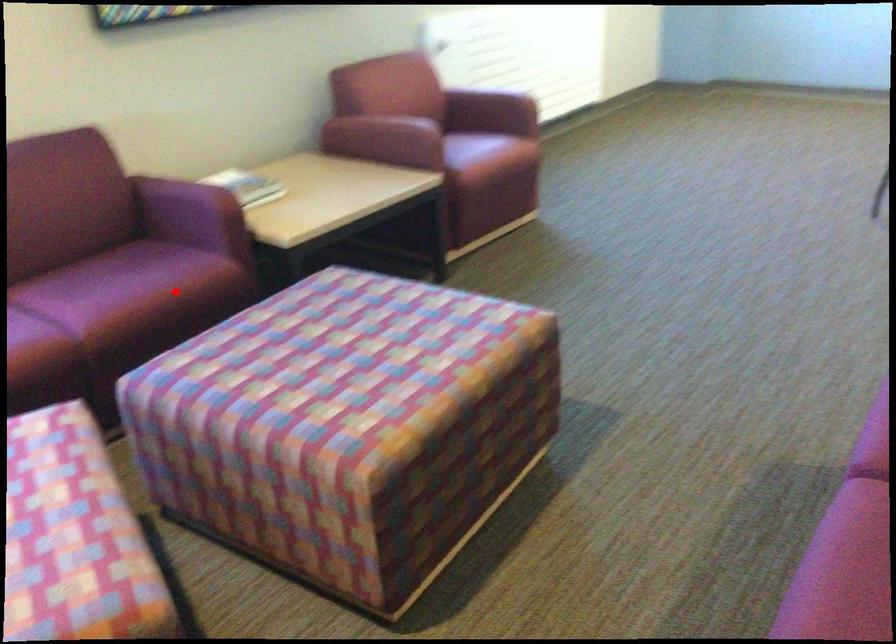
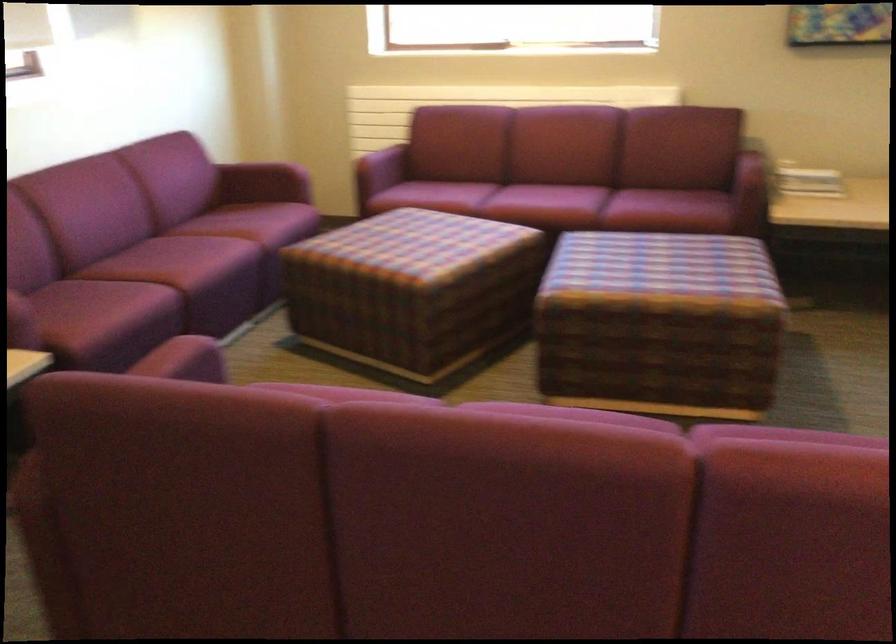
The point at the highlighted location is marked in the first image. Where is the corresponding point in the second image?

(668, 211)